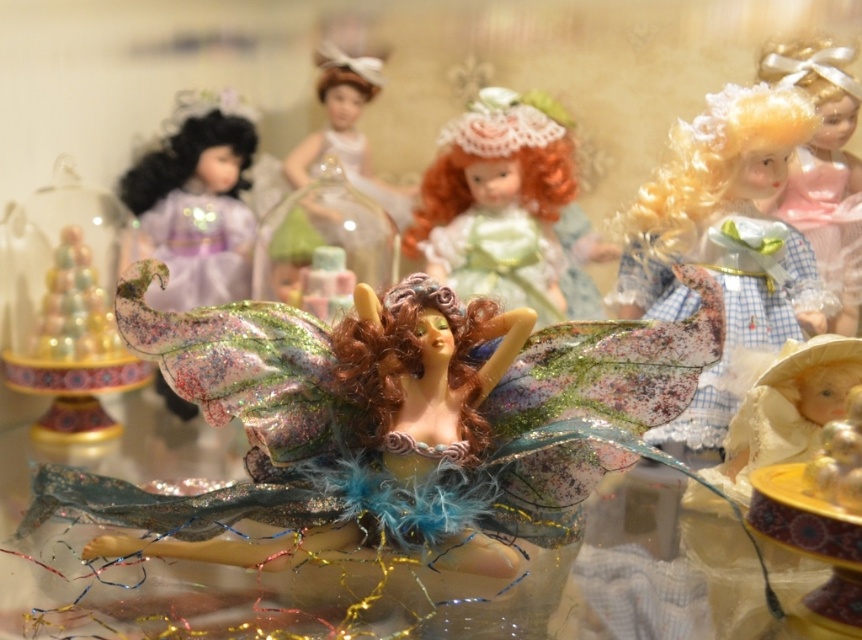
You are a collector who wants to place a new small figurine between the matte white doll at upper center and the translucent glass jar at center. Based on their sizes, which object should the new figurine be placed closer to?

The new figurine should be placed closer to the translucent glass jar at center because the matte white doll at upper center is taller than the translucent glass jar at center, so the jar is shorter and the new figurine can fit better near it.

You are a visitor at a doll exhibition and want to locate the matte white doll at upper center. Based on the coordinates provided, can you confirm if the point at [347,129] is the correct location for this doll?

Yes, the point at [347,129] corresponds to the location of the matte white doll at upper center as described.